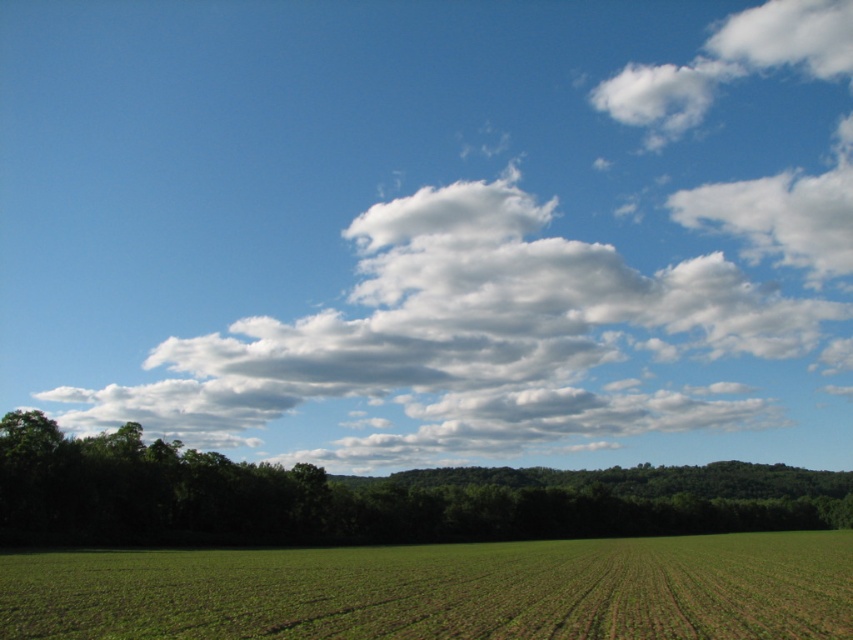
Looking at this image, measure the distance between point (416, 602) and camera.

Point (416, 602) is 72.67 feet from camera.

In the scene shown: Which of these two, green grass at lower center or green leafy tree at lower center, stands taller?

Standing taller between the two is green leafy tree at lower center.

Is point (784, 586) closer to viewer compared to point (373, 520)?

Yes, it is in front of point (373, 520).

You are a GUI agent. You are given a task and a screenshot of the screen. Output one action in this format:
    pyautogui.click(x=<x>, y=<y>)
    Task: Click on the green grass at lower center
    
    Given the screenshot: What is the action you would take?
    pyautogui.click(x=444, y=589)

Can you confirm if green grass at lower center is positioned to the right of white fluffy cloud at upper right?

Incorrect, green grass at lower center is not on the right side of white fluffy cloud at upper right.

Identify the location of green grass at lower center. (444, 589).

Is white fluffy cloud at upper center to the left of green grass at lower center from the viewer's perspective?

No, white fluffy cloud at upper center is not to the left of green grass at lower center.

Does white fluffy cloud at upper center have a lesser height compared to green grass at lower center?

Incorrect, white fluffy cloud at upper center's height does not fall short of green grass at lower center's.

Which is in front, point (51, 396) or point (44, 568)?

Point (44, 568) is in front.

Where is `white fluffy cloud at upper center`? The height and width of the screenshot is (640, 853). white fluffy cloud at upper center is located at coordinates (474, 340).